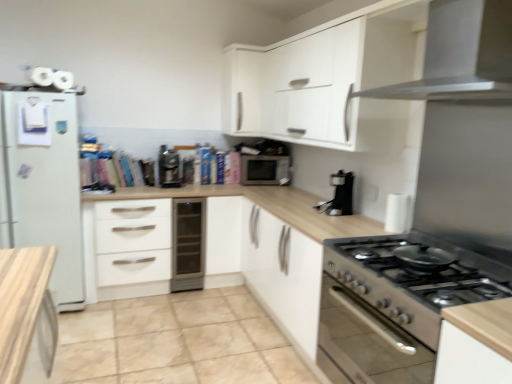
Question: Considering the relative sizes of satin silver dishwasher at center and satin black coffee machine at center, which appears as the second coffee machine when viewed from the right, in the image provided, is satin silver dishwasher at center shorter than satin black coffee machine at center, which appears as the second coffee machine when viewed from the right,?

Choices:
 (A) yes
 (B) no

Answer: (B)

Question: From a real-world perspective, is satin silver dishwasher at center positioned under satin black coffee machine at center, marked as the first coffee machine in a left-to-right arrangement, based on gravity?

Choices:
 (A) yes
 (B) no

Answer: (A)

Question: Does satin silver dishwasher at center have a lesser width compared to satin black coffee machine at center, the second coffee machine in the front-to-back sequence?

Choices:
 (A) no
 (B) yes

Answer: (A)

Question: Does satin silver dishwasher at center appear on the left side of satin black coffee machine at center, the second coffee machine in the front-to-back sequence?

Choices:
 (A) yes
 (B) no

Answer: (B)

Question: Is satin silver dishwasher at center smaller than satin black coffee machine at center, the 1th coffee machine viewed from the back?

Choices:
 (A) no
 (B) yes

Answer: (A)

Question: Would you say beige tile at lower center is to the left or to the right of satin silver dishwasher at center in the picture?

Choices:
 (A) right
 (B) left

Answer: (A)

Question: Considering their positions, is beige tile at lower center located in front of or behind satin silver dishwasher at center?

Choices:
 (A) behind
 (B) front

Answer: (B)

Question: Is beige tile at lower center inside or outside of satin silver dishwasher at center?

Choices:
 (A) inside
 (B) outside

Answer: (B)

Question: Considering the positions of beige tile at lower center and satin silver dishwasher at center in the image, is beige tile at lower center bigger or smaller than satin silver dishwasher at center?

Choices:
 (A) big
 (B) small

Answer: (A)

Question: Is beige tile at lower center in front of or behind stainless steel stove at lower right, the 1th kitchen appliance positioned from the bottom, in the image?

Choices:
 (A) behind
 (B) front

Answer: (A)

Question: From a real-world perspective, is beige tile at lower center above or below stainless steel stove at lower right, the 1th kitchen appliance positioned from the bottom?

Choices:
 (A) below
 (B) above

Answer: (A)

Question: In terms of size, does beige tile at lower center appear bigger or smaller than stainless steel stove at lower right, the 1th kitchen appliance positioned from the bottom?

Choices:
 (A) small
 (B) big

Answer: (B)

Question: From the image's perspective, is beige tile at lower center positioned above or below stainless steel stove at lower right, the second kitchen appliance positioned from the top?

Choices:
 (A) below
 (B) above

Answer: (A)

Question: Is white matte cabinet at upper center taller or shorter than satin black coffee machine at center, marked as the first coffee machine in a left-to-right arrangement?

Choices:
 (A) tall
 (B) short

Answer: (A)

Question: From a real-world perspective, relative to satin black coffee machine at center, which appears as the second coffee machine when viewed from the right, is white matte cabinet at upper center vertically above or below?

Choices:
 (A) below
 (B) above

Answer: (B)